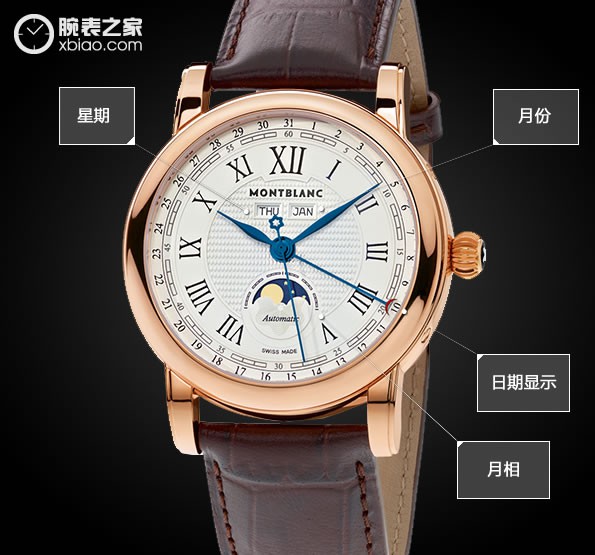
Where is `boxes`? boxes is located at coordinates (109, 109), (552, 117), (554, 375), (540, 470).